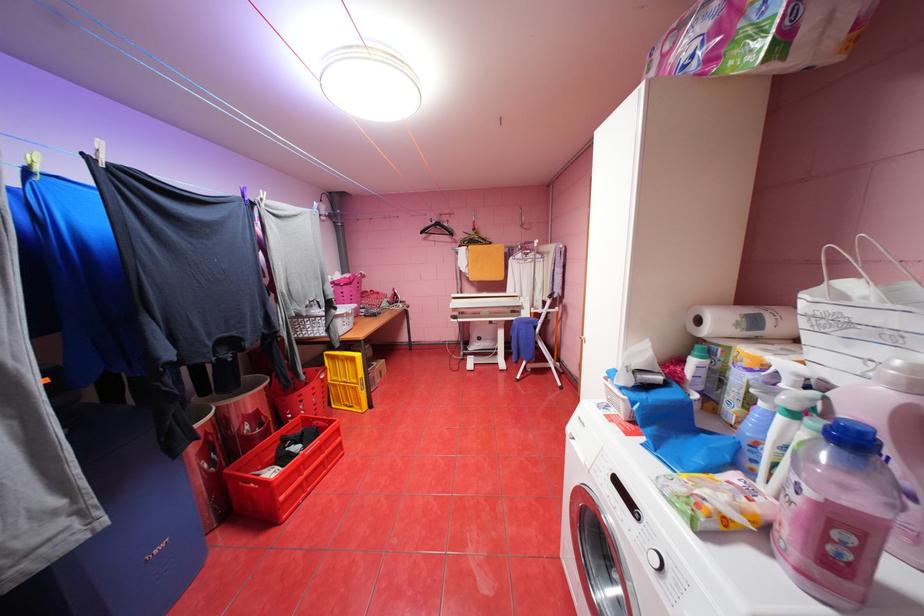
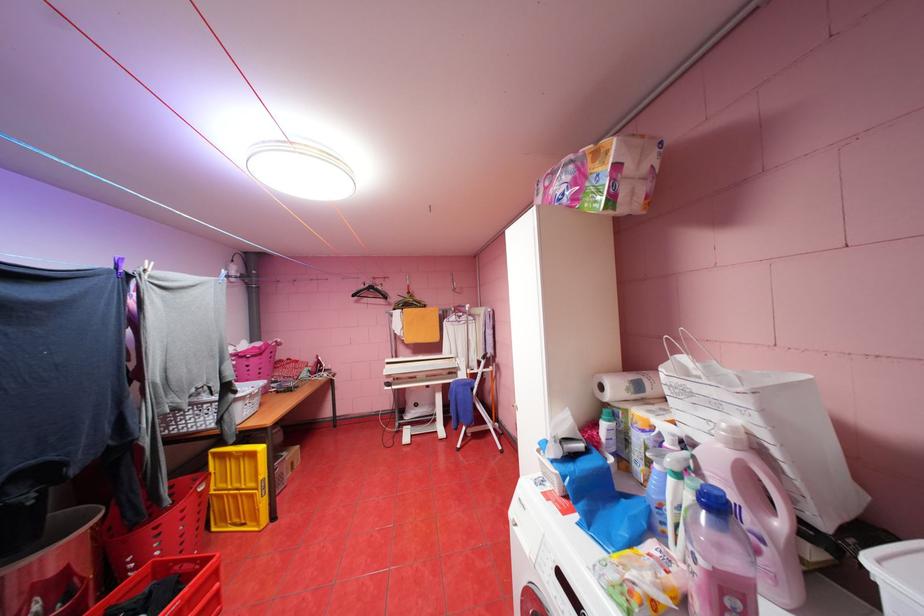
Locate, in the second image, the point that corresponds to [336,355] in the first image.

(224, 454)